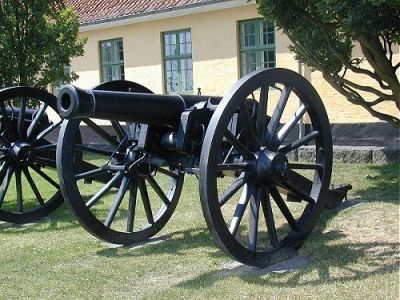
Find the location of a particular element. This screenshot has height=300, width=400. windows is located at coordinates (111, 65), (174, 69), (247, 58).